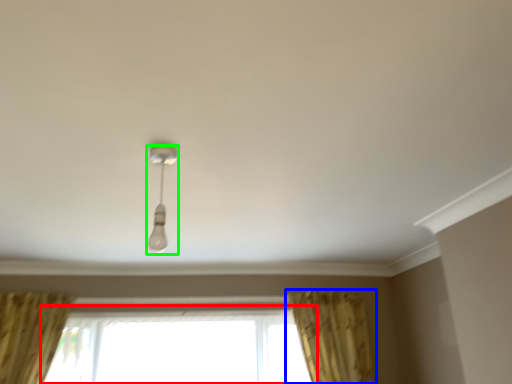
Question: Which is nearer to the window (highlighted by a red box)? curtain (highlighted by a blue box) or lamp (highlighted by a green box).

Choices:
 (A) curtain
 (B) lamp

Answer: (A)